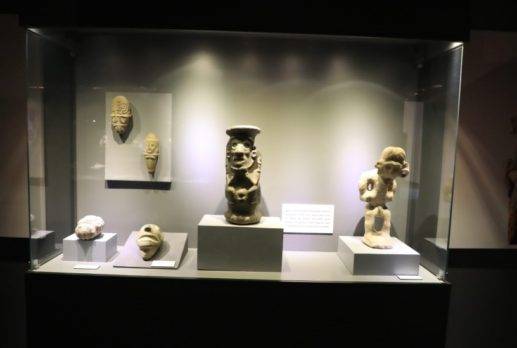
Find the location of a particular element. The height and width of the screenshot is (348, 517). ceiling is located at coordinates (462, 2).